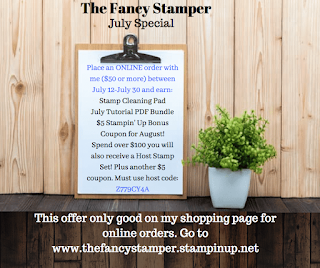
The width and height of the screenshot is (320, 268). Identify the location of clipboard. (128, 49).